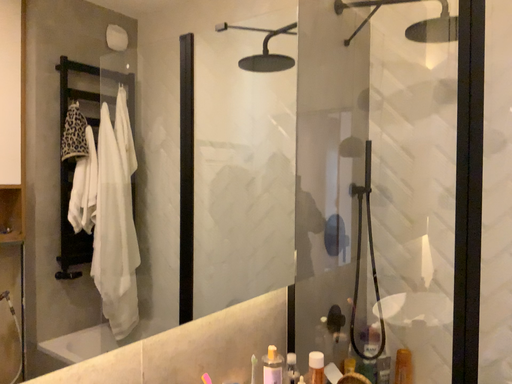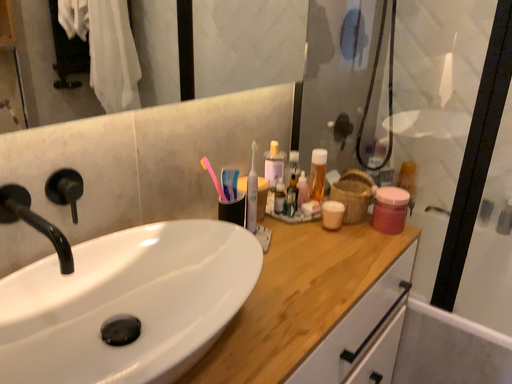
Question: Which way did the camera rotate in the video?

Choices:
 (A) rotated upward
 (B) rotated downward

Answer: (B)